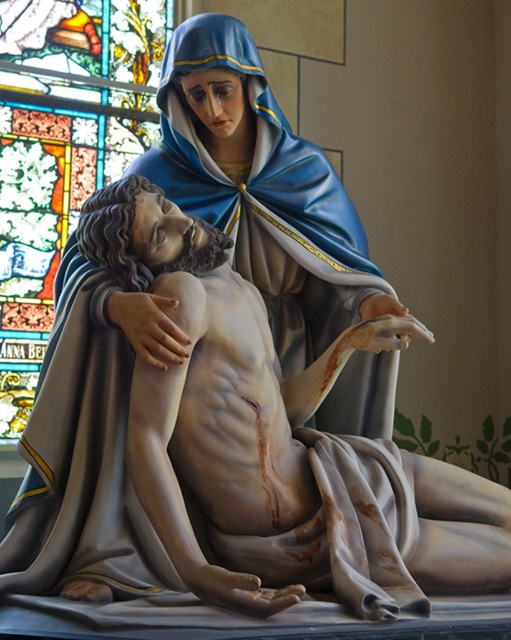
Question: Can you confirm if matte gray statue at center is positioned to the right of stained glass at upper left?

Choices:
 (A) no
 (B) yes

Answer: (B)

Question: Does matte gray statue at center come in front of stained glass at upper left?

Choices:
 (A) no
 (B) yes

Answer: (B)

Question: Does matte gray statue at center have a larger size compared to stained glass at upper left?

Choices:
 (A) yes
 (B) no

Answer: (B)